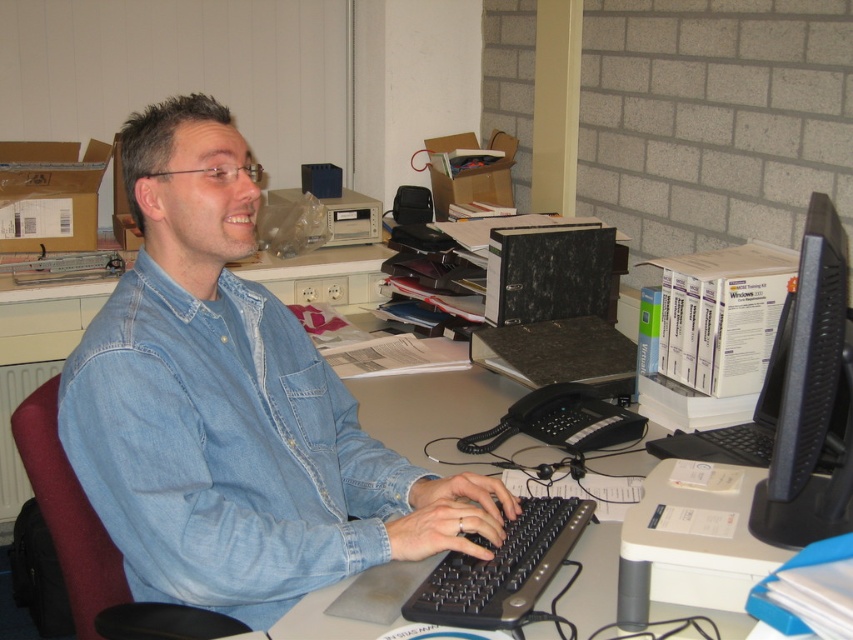
You are a delivery person who needs to place a small package on the desk. The desk has a black plastic monitor at right and a black plastic keyboard at center. Where should you place the package so that it doesn not block the monitor or the keyboard?

The black plastic monitor at right is in front of the black plastic keyboard at center, so placing the package behind the keyboard would avoid blocking either item.

You are standing in front of the desk in the office scene. There is a point marked at coordinates (x=810, y=397). Which object is this point located on?

The point at coordinates (x=810, y=397) is located on the black plastic monitor at right.